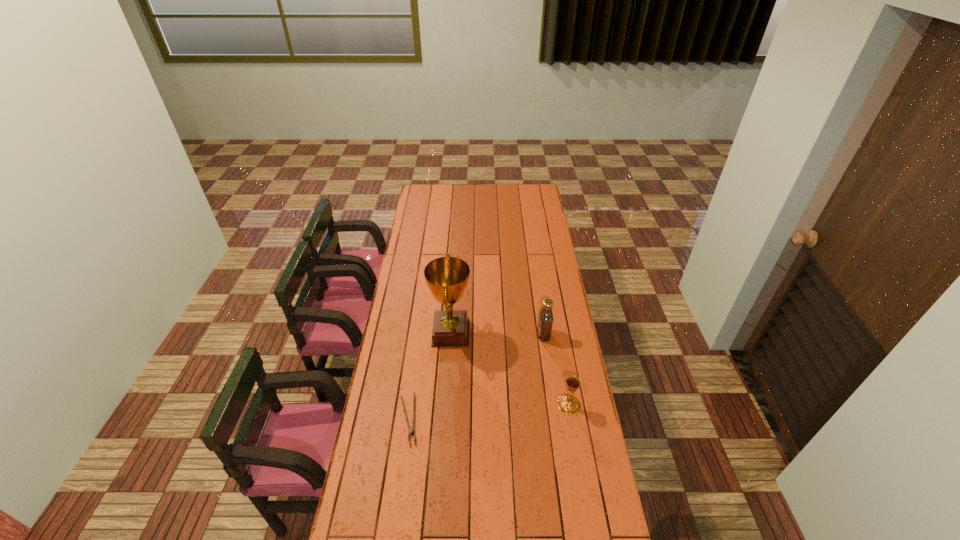
Find the location of `award`. award is located at coordinates tap(447, 277).

This screenshot has height=540, width=960. What are the coordinates of `the tallest object` in the screenshot? It's located at (447, 277).

Where is `vodka`? This screenshot has height=540, width=960. vodka is located at coordinates (545, 322).

Locate an element on the screen. chalice is located at coordinates (568, 404).

Locate an element on the screen. The image size is (960, 540). the shortest object is located at coordinates (411, 430).

You are a GUI agent. You are given a task and a screenshot of the screen. Output one action in this format:
    pyautogui.click(x=<x>, y=<y>)
    Task: Click on the tongs
    The height and width of the screenshot is (540, 960).
    Given the screenshot: What is the action you would take?
    pyautogui.click(x=411, y=430)

This screenshot has height=540, width=960. I want to click on blank space located on the plaque of the tallest object, so click(538, 333).

Identify the location of free point located 0.300m on the front-facing side of the vodka. (470, 335).

Image resolution: width=960 pixels, height=540 pixels. I want to click on free spot located 0.120m on the front-facing side of the vodka, so click(x=511, y=335).

The width and height of the screenshot is (960, 540). In order to click on vacant space located on the front-facing side of the vodka in this screenshot , I will do 487,335.